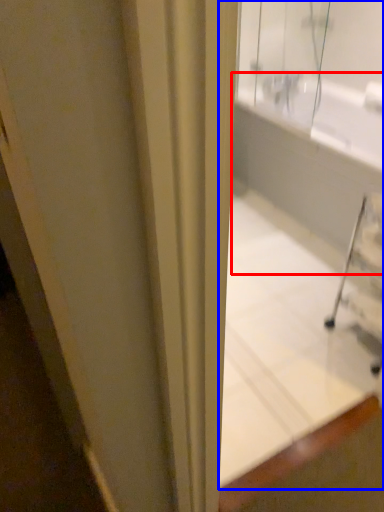
Question: Which object appears farthest to the camera in this image, bath (highlighted by a red box) or bathtub (highlighted by a blue box)?

Choices:
 (A) bath
 (B) bathtub

Answer: (A)